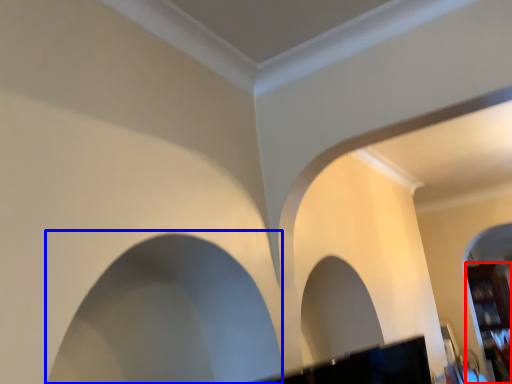
Question: Which of the following is the closest to the observer, furniture (highlighted by a red box) or rock arch (highlighted by a blue box)?

Choices:
 (A) furniture
 (B) rock arch

Answer: (B)